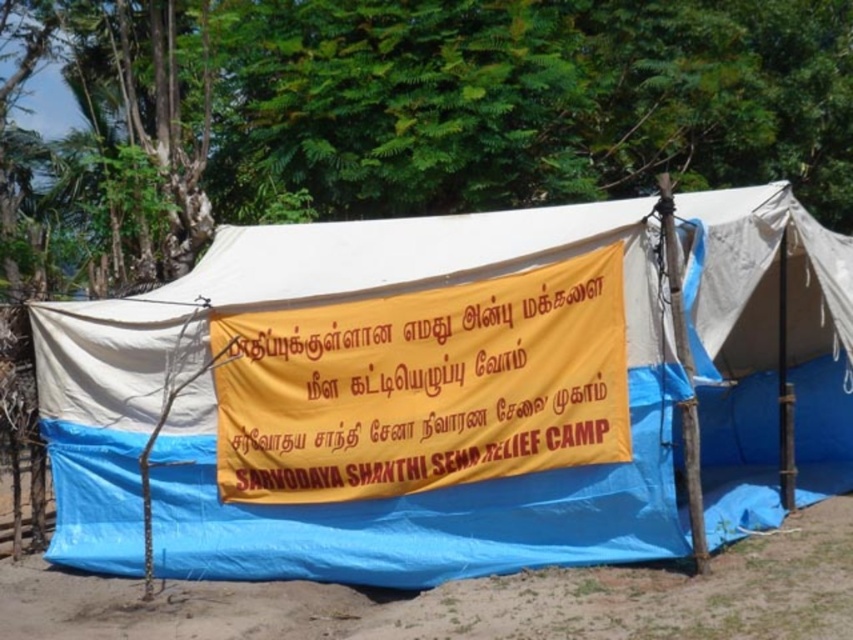
Question: Which point is farther to the camera?

Choices:
 (A) blue tarpaulin tent at center
 (B) yellow fabric banner at center
 (C) brown dirt field at lower center

Answer: (A)

Question: Which point is farther to the camera?

Choices:
 (A) (519, 417)
 (B) (550, 541)
 (C) (428, 195)
 (D) (360, 598)

Answer: (C)

Question: Is green leafy tree at upper center below brown dirt field at lower center?

Choices:
 (A) no
 (B) yes

Answer: (A)

Question: Which of the following is the farthest from the observer?

Choices:
 (A) (3, 570)
 (B) (256, 61)

Answer: (B)

Question: Is yellow fabric banner at center thinner than brown dirt field at lower center?

Choices:
 (A) yes
 (B) no

Answer: (B)

Question: Does yellow fabric banner at center have a greater width compared to brown dirt field at lower center?

Choices:
 (A) no
 (B) yes

Answer: (B)